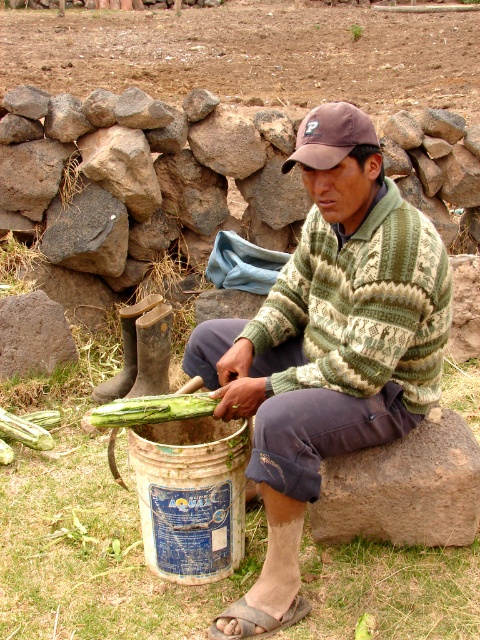
You are a photographer trying to capture the man and the squash in the image. Since the brown rough stone at lower right is below the green rough squash at center, where should you position yourself to ensure both the man and the squash are visible in the frame?

Position yourself at a lower angle so that you can see both the brown rough stone at lower right and the green rough squash at center, as the stone is below the squash in the image.

You are a farmer who needs to place both the green rough corn at center and the green rough squash at center into a storage bin. Which one should you place first to ensure proper stacking?

The green rough corn at center is above the green rough squash at center, so you should place the green rough squash at center first to create a stable base for stacking.